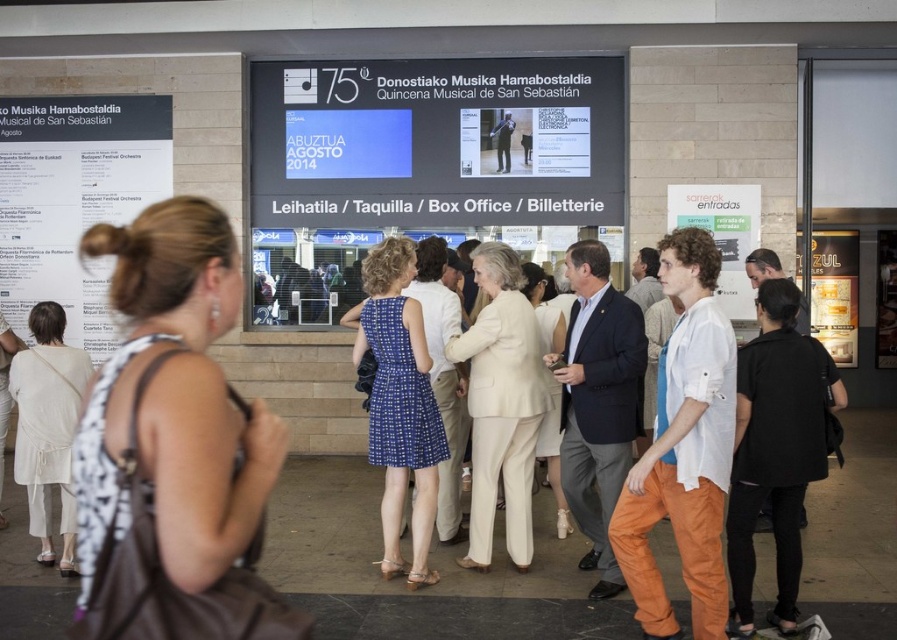
From the picture: Who is higher up, white cotton dress at lower left or metallic gold sign at right?

Positioned higher is metallic gold sign at right.

Can you confirm if white cotton dress at lower left is bigger than metallic gold sign at right?

Yes, white cotton dress at lower left is bigger than metallic gold sign at right.

Which is in front, point (83, 387) or point (817, 305)?

Point (83, 387)

In order to click on white cotton dress at lower left in this screenshot , I will do `click(48, 428)`.

Is white paper poster at left smaller than metallic gold sign at right?

No, white paper poster at left is not smaller than metallic gold sign at right.

Which is behind, point (30, 259) or point (840, 294)?

The point (840, 294) is more distant.

This screenshot has height=640, width=897. I want to click on white paper poster at left, so click(73, 198).

Identify the location of white paper poster at left. Image resolution: width=897 pixels, height=640 pixels. (73, 198).

Does white paper poster at left have a greater height compared to white cotton dress at lower left?

Yes.

Can you confirm if white paper poster at left is positioned to the right of white cotton dress at lower left?

No, white paper poster at left is not to the right of white cotton dress at lower left.

Is point (58, 273) closer to viewer compared to point (42, 324)?

No, it is not.

The height and width of the screenshot is (640, 897). I want to click on white paper poster at left, so click(x=73, y=198).